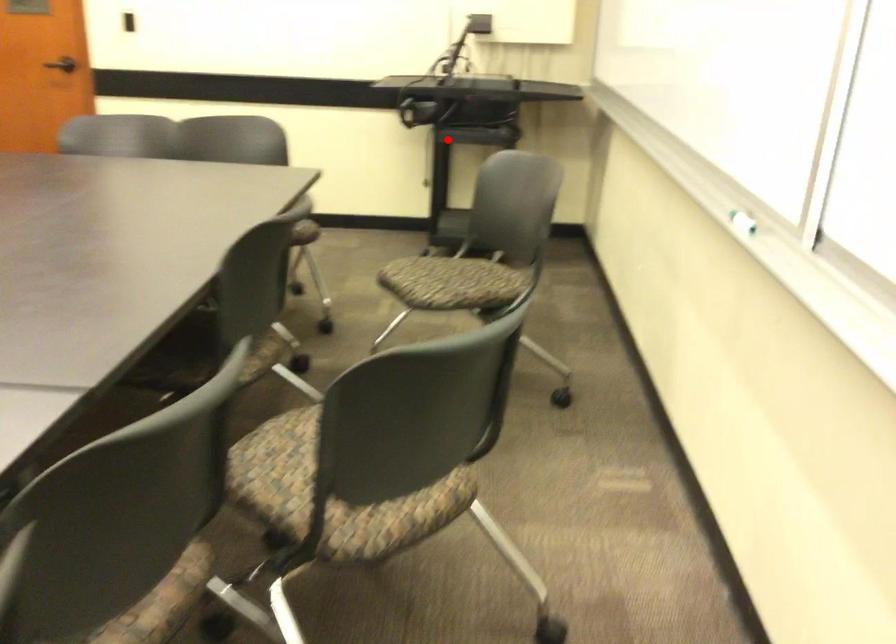
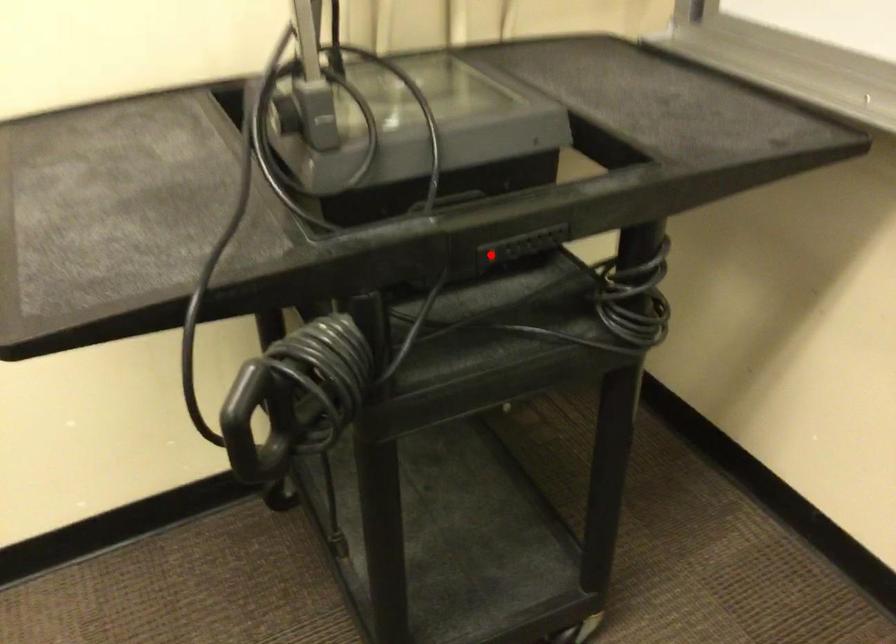
I am providing you with two images of the same scene from different viewpoints. A red point is marked on the first image and another point is marked on the second image. Are the points marked in image1 and image2 representing the same 3D position?

Yes